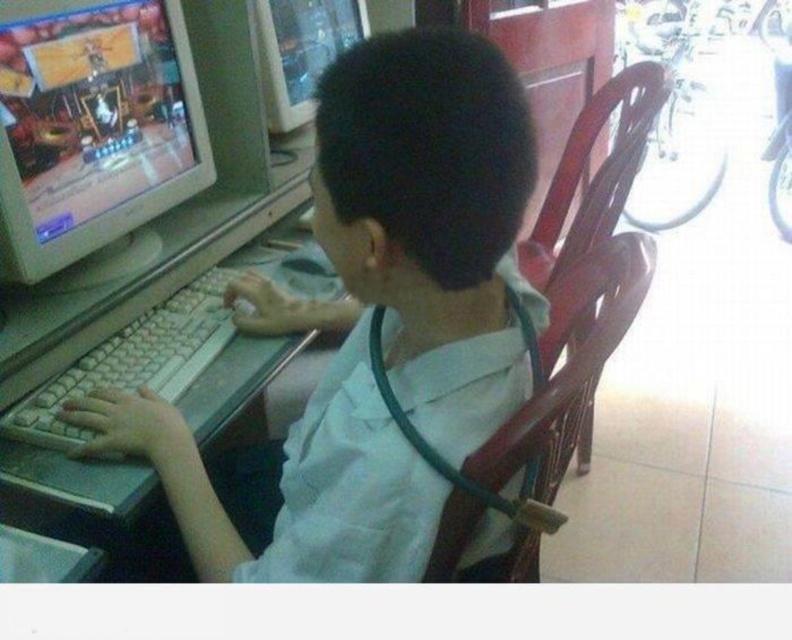
Can you confirm if white plastic keyboard at center is wider than matte plastic computer monitor at upper center?

Correct, the width of white plastic keyboard at center exceeds that of matte plastic computer monitor at upper center.

Is point (139, 364) positioned after point (341, 12)?

No, it is not.

Identify the location of white plastic keyboard at center. This screenshot has height=640, width=792. (132, 362).

Is white matte shirt at center below matte plastic monitor at left?

Correct, white matte shirt at center is located below matte plastic monitor at left.

Which is in front, point (509, 70) or point (150, 48)?

Point (509, 70) is more forward.

Find the location of a particular element. The image size is (792, 640). white matte shirt at center is located at coordinates (371, 317).

Is white matte shirt at center thinner than white plastic keyboard at center?

In fact, white matte shirt at center might be wider than white plastic keyboard at center.

Describe the element at coordinates (371, 317) in the screenshot. I see `white matte shirt at center` at that location.

At what (x,y) coordinates should I click in order to perform the action: click on white matte shirt at center. Please return your answer as a coordinate pair (x, y). The image size is (792, 640). Looking at the image, I should click on (371, 317).